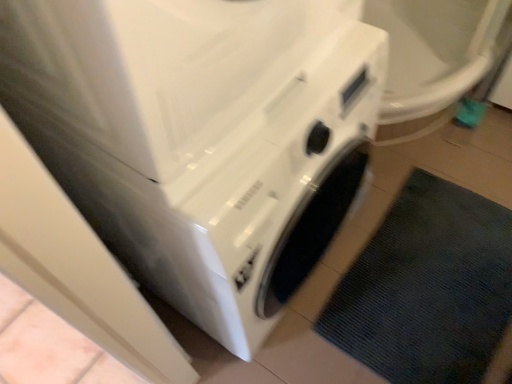
Question: From the image's perspective, is dark gray textured bath mat at lower right located beneath white glossy washing machine at center?

Choices:
 (A) yes
 (B) no

Answer: (A)

Question: From the image's perspective, does dark gray textured bath mat at lower right appear higher than white glossy washing machine at center?

Choices:
 (A) no
 (B) yes

Answer: (A)

Question: Is dark gray textured bath mat at lower right smaller than white glossy washing machine at center?

Choices:
 (A) no
 (B) yes

Answer: (B)

Question: Is dark gray textured bath mat at lower right completely or partially outside of white glossy washing machine at center?

Choices:
 (A) yes
 (B) no

Answer: (A)

Question: Is dark gray textured bath mat at lower right turned away from white glossy washing machine at center?

Choices:
 (A) no
 (B) yes

Answer: (A)

Question: Does dark gray textured bath mat at lower right have a lesser height compared to white glossy washing machine at center?

Choices:
 (A) no
 (B) yes

Answer: (B)

Question: Can dark gray textured bath mat at lower right be found inside white glossy washing machine at center?

Choices:
 (A) yes
 (B) no

Answer: (B)

Question: Is the surface of white glossy washing machine at center in direct contact with dark gray textured bath mat at lower right?

Choices:
 (A) yes
 (B) no

Answer: (B)

Question: Does white glossy washing machine at center appear on the left side of dark gray textured bath mat at lower right?

Choices:
 (A) yes
 (B) no

Answer: (A)

Question: Is white glossy washing machine at center aimed at dark gray textured bath mat at lower right?

Choices:
 (A) no
 (B) yes

Answer: (B)

Question: Would you say white glossy washing machine at center is a long distance from dark gray textured bath mat at lower right?

Choices:
 (A) yes
 (B) no

Answer: (B)

Question: From a real-world perspective, is white glossy washing machine at center located higher than dark gray textured bath mat at lower right?

Choices:
 (A) yes
 (B) no

Answer: (A)

Question: Considering their positions, is white glossy washing machine at center located in front of or behind dark gray textured bath mat at lower right?

Choices:
 (A) behind
 (B) front

Answer: (B)